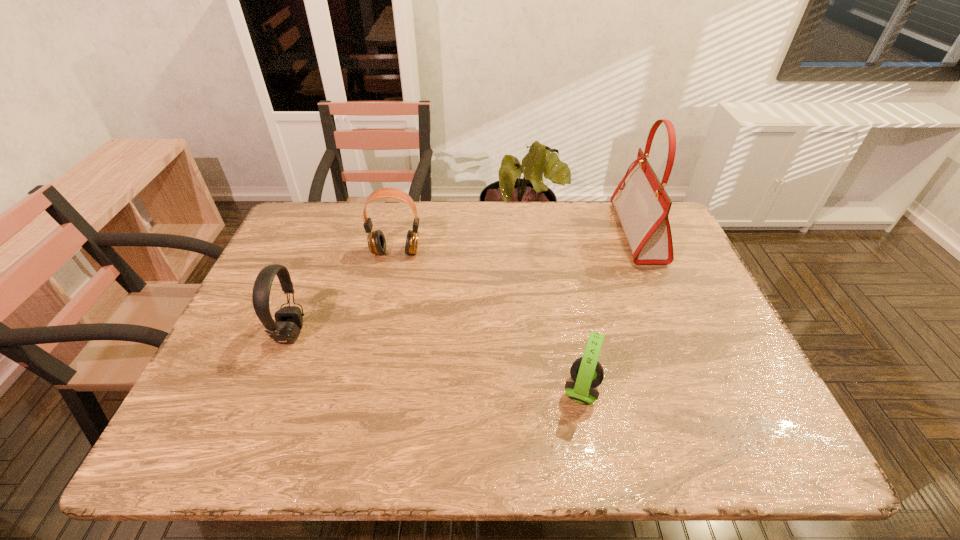
Locate an element on the screen. vacant space that's between the second farthest headset and the tallest object is located at coordinates (465, 282).

Where is `free spot between the second headset from left to right and the third object from left to right`? The image size is (960, 540). free spot between the second headset from left to right and the third object from left to right is located at coordinates (489, 321).

At what (x,y) coordinates should I click in order to perform the action: click on free space between the rightmost object and the shortest object. Please return your answer as a coordinate pair (x, y). This screenshot has height=540, width=960. Looking at the image, I should click on (610, 312).

I want to click on free spot between the leftmost object and the second headset from left to right, so click(344, 292).

The width and height of the screenshot is (960, 540). Identify the location of object identified as the closest to the tallest object. (587, 373).

Where is `object that is the closest to the third object from right to left`? The width and height of the screenshot is (960, 540). object that is the closest to the third object from right to left is located at coordinates (288, 323).

In order to click on headset object that ranks as the second closest to the third farthest object in this screenshot , I will do `click(587, 373)`.

Where is `the second closest headset to the second object from left to right`? the second closest headset to the second object from left to right is located at coordinates (587, 373).

At what (x,y) coordinates should I click in order to perform the action: click on vacant space that satisfies the following two spatial constraints: 1. on the front-facing side of the nearest headset; 2. on the right side of the second farthest headset. Please return your answer as a coordinate pair (x, y). The width and height of the screenshot is (960, 540). Looking at the image, I should click on click(x=268, y=390).

In order to click on vacant region that satisfies the following two spatial constraints: 1. on the ear cups of the third object from right to left; 2. on the front-facing side of the leftmost headset in this screenshot , I will do `click(378, 333)`.